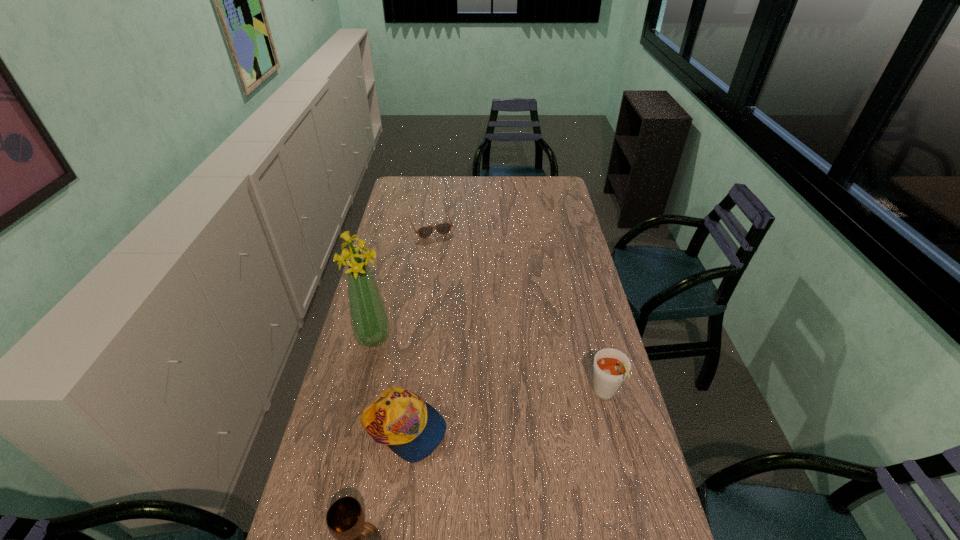
Find the location of a particular element. This screenshot has width=960, height=540. vacant spot on the desktop that is between the chalice and the root beer and is positioned on the bill of the fourth tallest object is located at coordinates (528, 444).

Where is `free spot on the desktop that is between the chalice and the root beer and is positioned on the front-facing side of the bouquet`? This screenshot has width=960, height=540. free spot on the desktop that is between the chalice and the root beer and is positioned on the front-facing side of the bouquet is located at coordinates (523, 447).

Identify the location of vacant space on the desktop that is between the chalice and the rightmost object and is positioned on the front-facing side of the farthest object. This screenshot has height=540, width=960. (x=529, y=443).